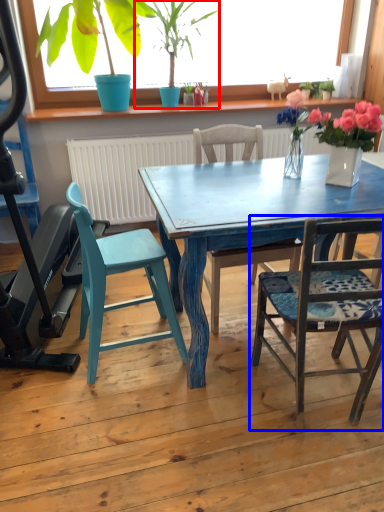
Question: Which point is further to the camera, houseplant (highlighted by a red box) or chair (highlighted by a blue box)?

Choices:
 (A) houseplant
 (B) chair

Answer: (A)